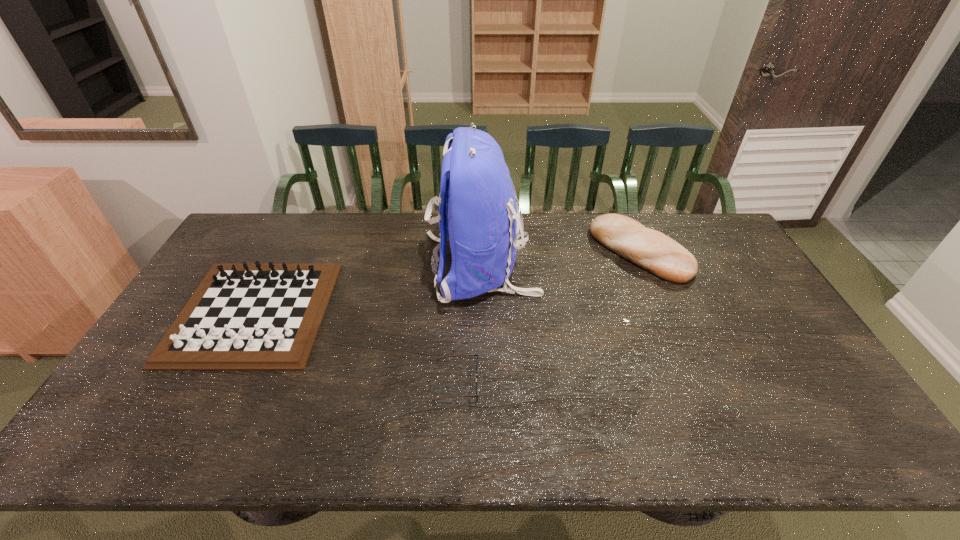
The height and width of the screenshot is (540, 960). Find the location of `backpack that is at the far edge`. backpack that is at the far edge is located at coordinates (477, 205).

What are the coordinates of `bread that is at the far edge` in the screenshot? It's located at (650, 249).

Image resolution: width=960 pixels, height=540 pixels. Identify the location of object that is positioned at the left edge. (242, 317).

This screenshot has height=540, width=960. I want to click on free space at the far edge of the desktop, so click(318, 222).

The width and height of the screenshot is (960, 540). In order to click on free region at the near edge of the desktop in this screenshot , I will do `click(473, 441)`.

In the image, there is a desktop. At what (x,y) coordinates should I click in order to perform the action: click on free space at the right edge. Please return your answer as a coordinate pair (x, y). Image resolution: width=960 pixels, height=540 pixels. Looking at the image, I should click on (756, 284).

This screenshot has width=960, height=540. I want to click on vacant space at the far left corner, so click(244, 240).

This screenshot has height=540, width=960. I want to click on free region at the near left corner of the desktop, so click(108, 450).

The image size is (960, 540). I want to click on unoccupied position between the shortest object and the bread, so click(548, 316).

Identify the location of free space that is in between the spectacles and the leftmost object. (355, 346).